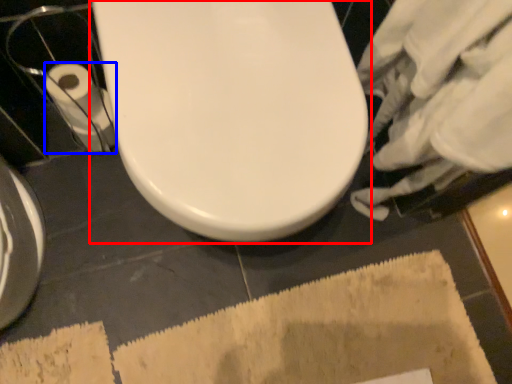
Question: Which point is further to the camera, toilet (highlighted by a red box) or toilet paper (highlighted by a blue box)?

Choices:
 (A) toilet
 (B) toilet paper

Answer: (B)